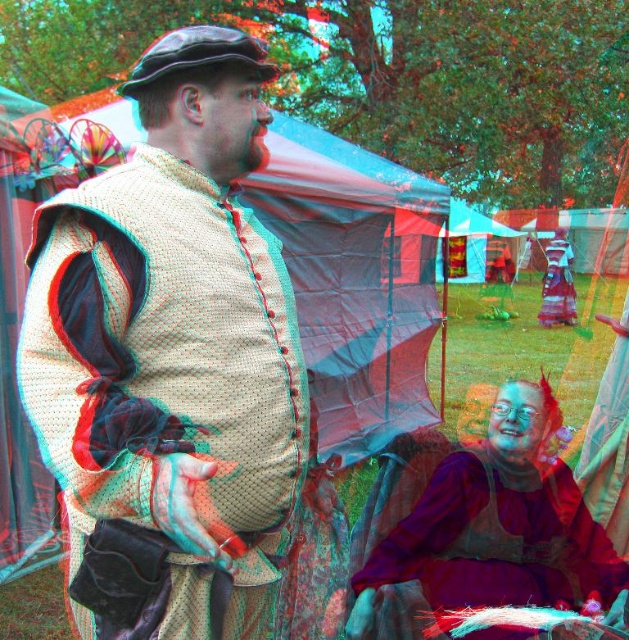
You are a photographer at the event and want to capture both the matte beige vest at center and the purple velvet dress at lower right in the same frame. Based on their positions, which object should you focus on first to ensure both are in focus?

Since the matte beige vest at center is above the purple velvet dress at lower right, you should focus on the matte beige vest at center first to ensure both are in focus as it is closer to the camera.

What is located at the coordinates point (174, 365) in the image?

The point (174, 365) indicates the location of the matte beige vest at center.